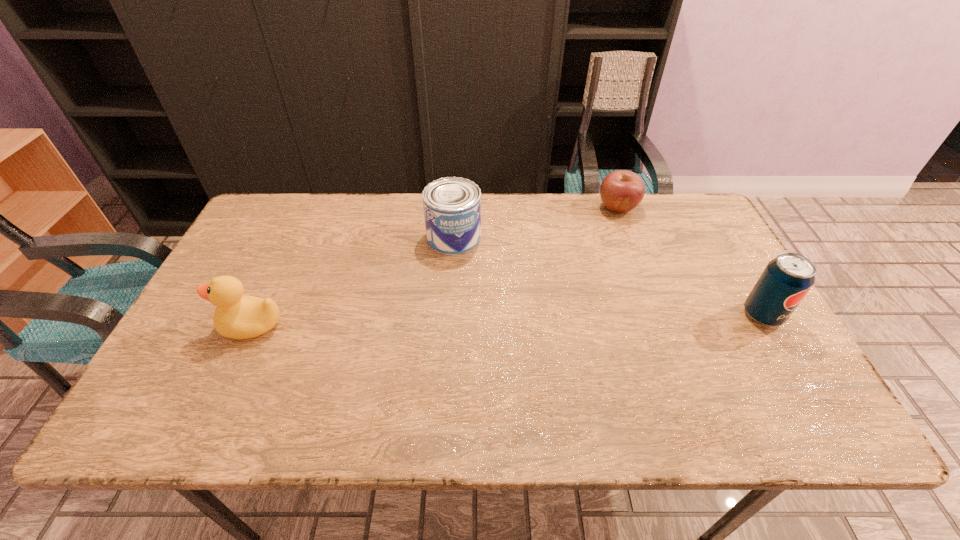
Where is `vacant space that is in between the duck and the shortest object`? The height and width of the screenshot is (540, 960). vacant space that is in between the duck and the shortest object is located at coordinates (435, 266).

At what (x,y) coordinates should I click in order to perform the action: click on free space between the soda can and the leftmost object. Please return your answer as a coordinate pair (x, y). Looking at the image, I should click on (508, 320).

At what (x,y) coordinates should I click in order to perform the action: click on object that is the second nearest to the second farthest object. Please return your answer as a coordinate pair (x, y). The width and height of the screenshot is (960, 540). Looking at the image, I should click on (237, 316).

Select which object is the closest to the second object from left to right. Please provide its 2D coordinates. Your answer should be formatted as a tuple, i.e. [(x, y)], where the tuple contains the x and y coordinates of a point satisfying the conditions above.

[(621, 191)]

You are a GUI agent. You are given a task and a screenshot of the screen. Output one action in this format:
    pyautogui.click(x=<x>, y=<y>)
    Task: Click on the vacant space that satisfies the following two spatial constraints: 1. on the front side of the second object from right to left; 2. on the right side of the rightmost object
    Image resolution: width=960 pixels, height=540 pixels.
    Given the screenshot: What is the action you would take?
    pyautogui.click(x=658, y=315)

Image resolution: width=960 pixels, height=540 pixels. Identify the location of vacant space that satisfies the following two spatial constraints: 1. on the front side of the second object from left to right; 2. on the left side of the rightmost object. (449, 315).

Identify the location of free spot that satisfies the following two spatial constraints: 1. on the front side of the soda can; 2. on the left side of the third object from left to right. Image resolution: width=960 pixels, height=540 pixels. (658, 315).